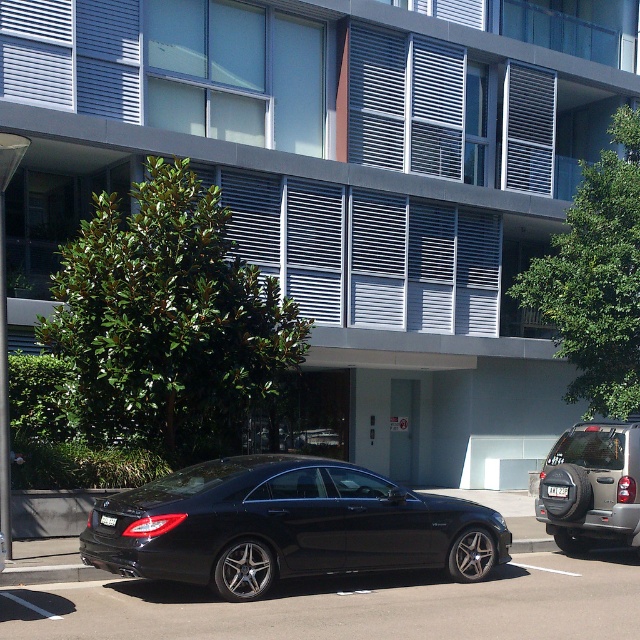
You are a parking attendant and need to fit both the glossy black car at center and the shiny black sedan at center into a parking spot that is 5 meters long. Given their sizes, which car should you park first to ensure both fit?

The glossy black car at center is larger than the shiny black sedan at center. To fit both into the 5 meter parking spot, you should park the glossy black car at center first, then the shiny black sedan at center, ensuring the larger vehicle occupies more space first.